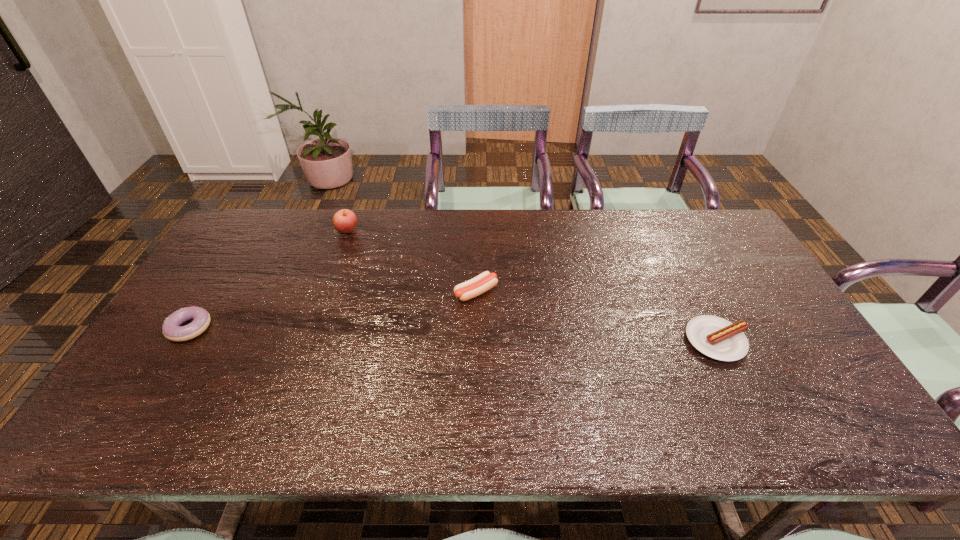
Locate an element on the screen. apple is located at coordinates (344, 221).

The height and width of the screenshot is (540, 960). I want to click on the farthest object, so click(x=344, y=221).

Find the location of a particular element. The width and height of the screenshot is (960, 540). the second farthest object is located at coordinates (476, 286).

Locate an element on the screen. The height and width of the screenshot is (540, 960). the third object from left to right is located at coordinates (476, 286).

Where is `the leftmost object`? Image resolution: width=960 pixels, height=540 pixels. the leftmost object is located at coordinates (171, 329).

Locate an element on the screen. The width and height of the screenshot is (960, 540). the nearer sausage is located at coordinates (715, 337).

I want to click on the right sausage, so click(x=715, y=337).

The height and width of the screenshot is (540, 960). I want to click on free space located on the right of the farthest object, so click(475, 230).

Where is `vacant space located on the back of the farther sausage`? The height and width of the screenshot is (540, 960). vacant space located on the back of the farther sausage is located at coordinates (477, 218).

Identify the location of free region located 0.140m on the back of the leftmost object. (221, 279).